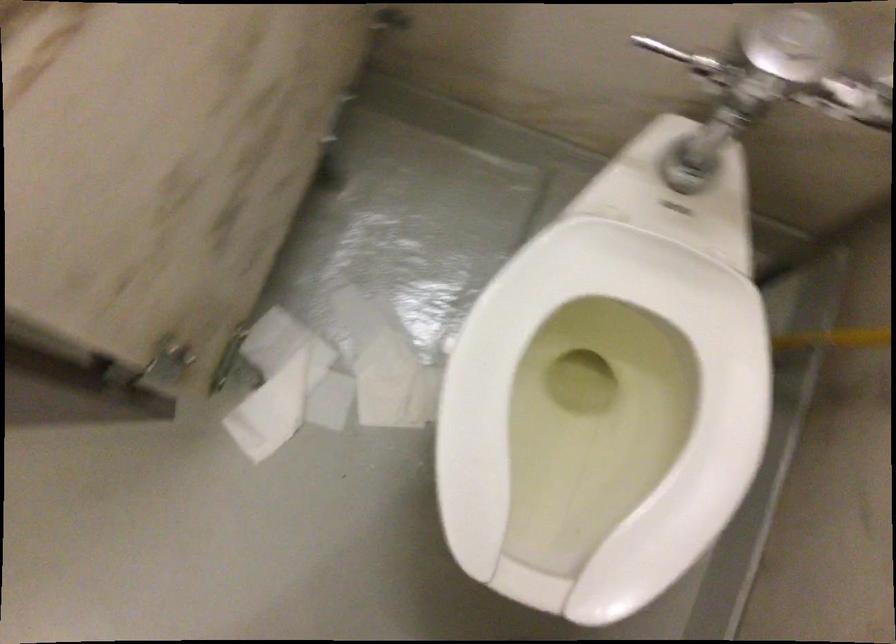
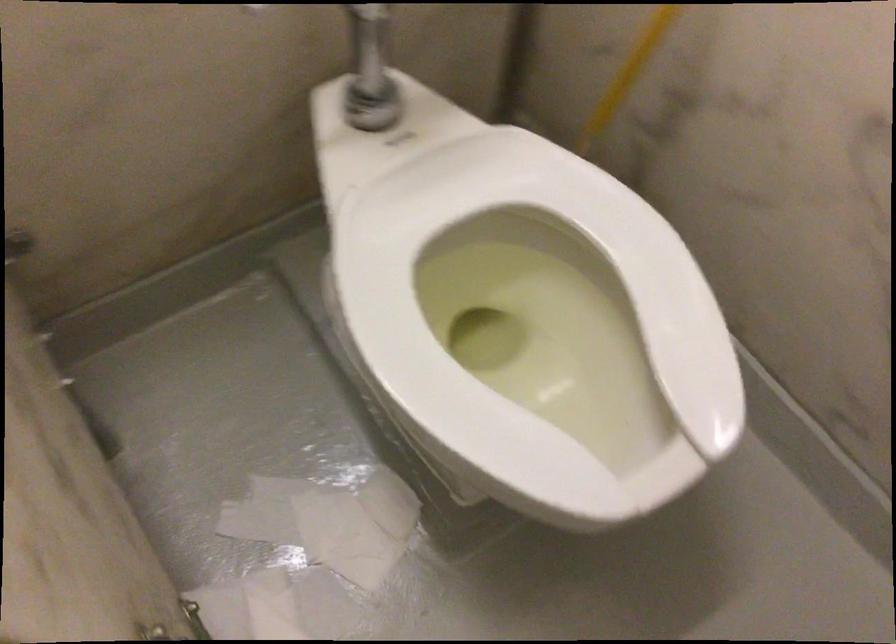
The point at (670,359) is marked in the first image. Where is the corresponding point in the second image?

(536, 254)